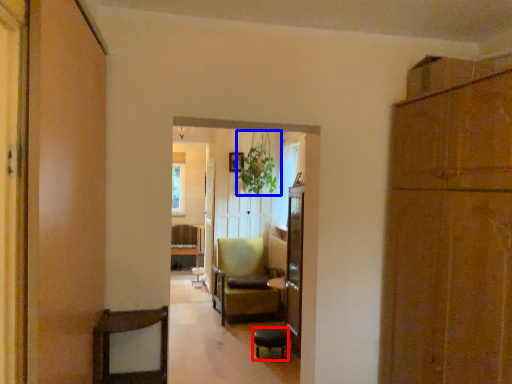
Question: Which object appears farthest to the camera in this image, bar stool (highlighted by a red box) or plant (highlighted by a blue box)?

Choices:
 (A) bar stool
 (B) plant

Answer: (B)